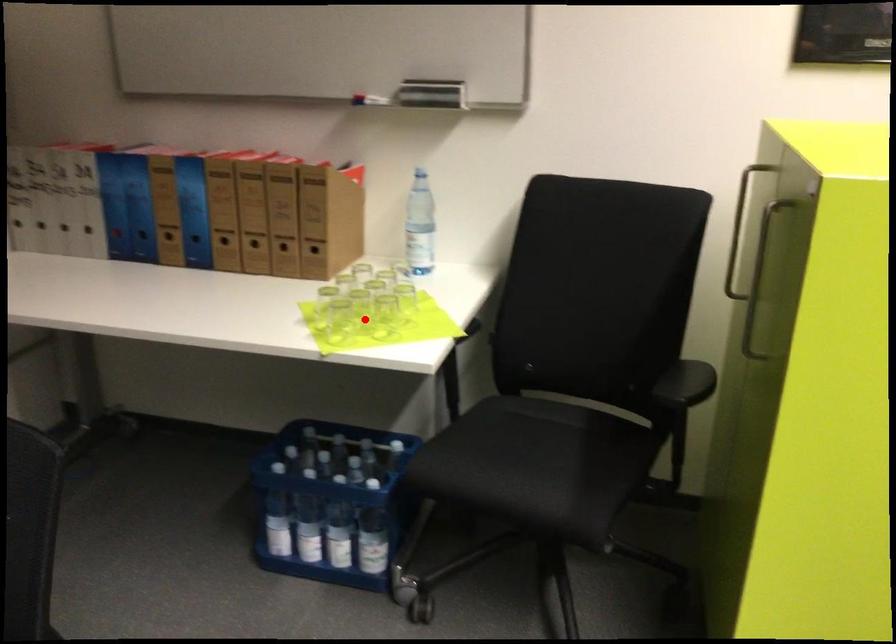
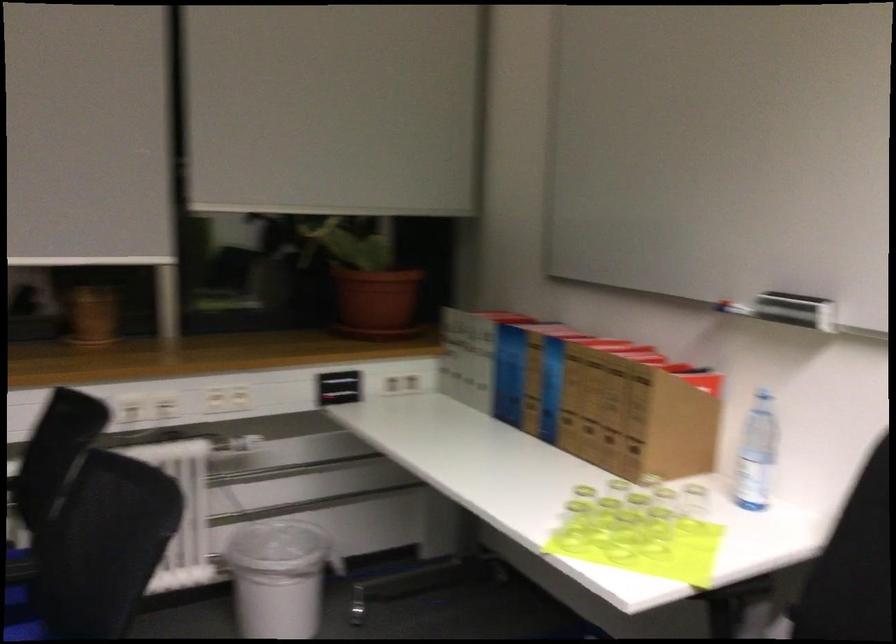
Question: I am providing you with two images of the same scene from different viewpoints. Image1 has a red point marked. In image2, the corresponding 3D location appears at what relative position? Reply with the corresponding letter.

Choices:
 (A) Closer
 (B) Farther

Answer: (A)